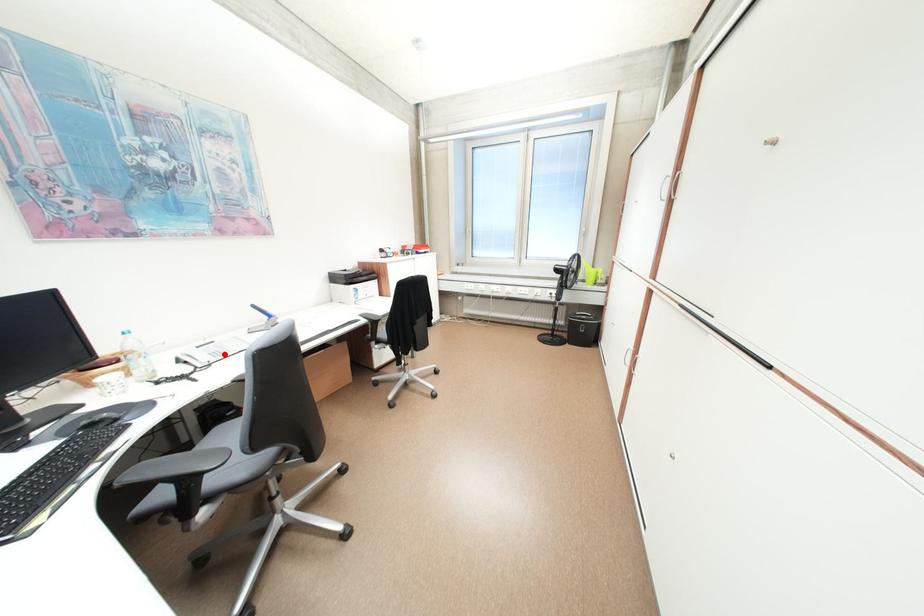
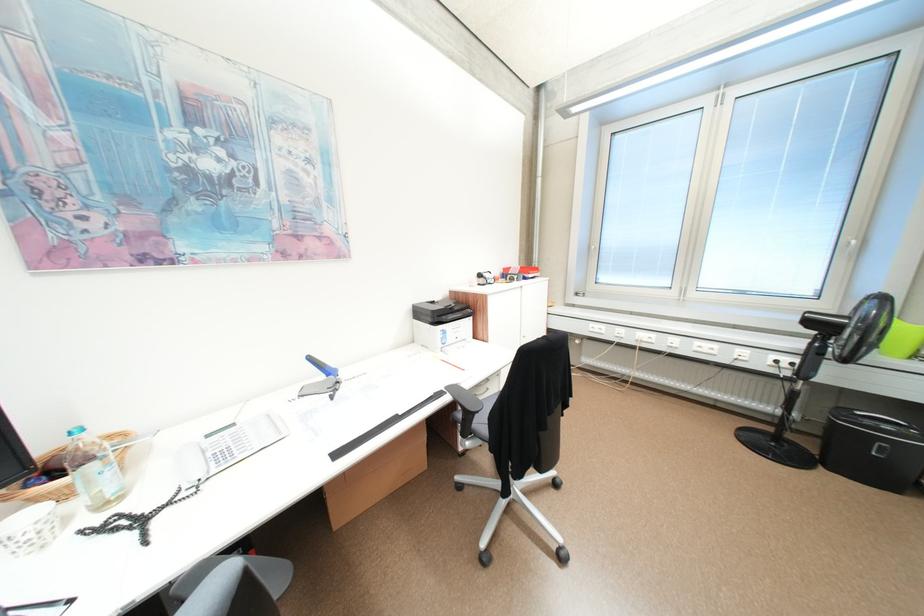
Question: I am providing you with two images of the same scene from different viewpoints. Image1 has a red point marked. In image2, the corresponding 3D location appears at what relative position? Reply with the corresponding letter.

Choices:
 (A) Closer
 (B) Farther

Answer: (A)